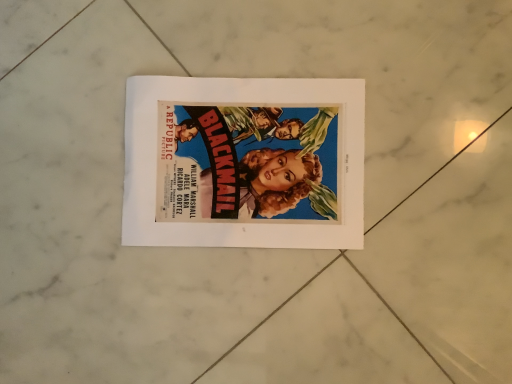
Where is `blank area beneath matte paper poster at center (from a real-world perspective)`? The width and height of the screenshot is (512, 384). blank area beneath matte paper poster at center (from a real-world perspective) is located at coordinates (241, 165).